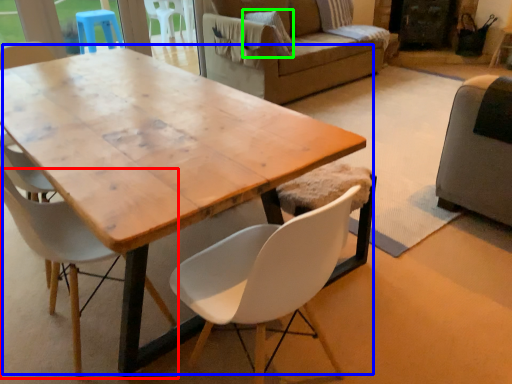
Question: Which object is positioned farthest from chair (highlighted by a red box)? Select from coffee table (highlighted by a blue box) and pillow (highlighted by a green box).

Choices:
 (A) coffee table
 (B) pillow

Answer: (B)